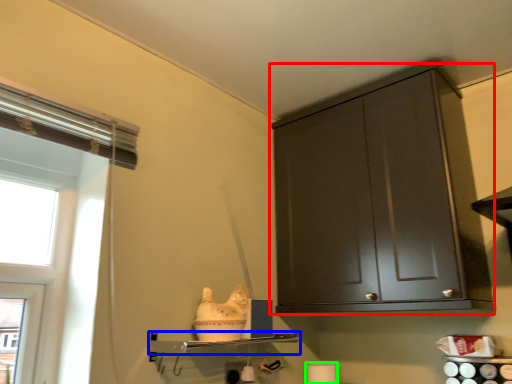
Question: Estimate the real-world distances between objects in this image. Which object is farther from cabinetry (highlighted by a red box), shelf (highlighted by a blue box) or toilet paper (highlighted by a green box)?

Choices:
 (A) shelf
 (B) toilet paper

Answer: (B)